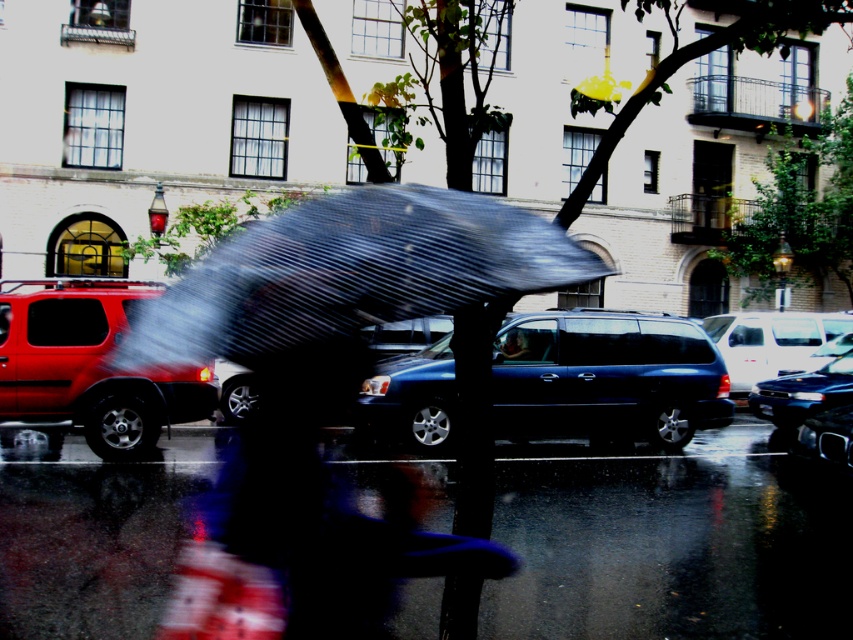
Between glossy asphalt pavement at lower center and shiny black sedan at center, which one is positioned lower?

glossy asphalt pavement at lower center is below.

Is glossy asphalt pavement at lower center below shiny black sedan at center?

Indeed, glossy asphalt pavement at lower center is positioned under shiny black sedan at center.

Find the location of a particular element. The width and height of the screenshot is (853, 640). glossy asphalt pavement at lower center is located at coordinates (670, 541).

Is matte red suv at left above white matte suv at right?

Incorrect, matte red suv at left is not positioned above white matte suv at right.

Does matte red suv at left have a lesser height compared to white matte suv at right?

In fact, matte red suv at left may be taller than white matte suv at right.

Image resolution: width=853 pixels, height=640 pixels. I want to click on matte red suv at left, so click(x=90, y=365).

Is point (840, 572) positioned after point (85, 368)?

No, it is not.

This screenshot has width=853, height=640. In order to click on glossy asphalt pavement at lower center in this screenshot , I will do `click(670, 541)`.